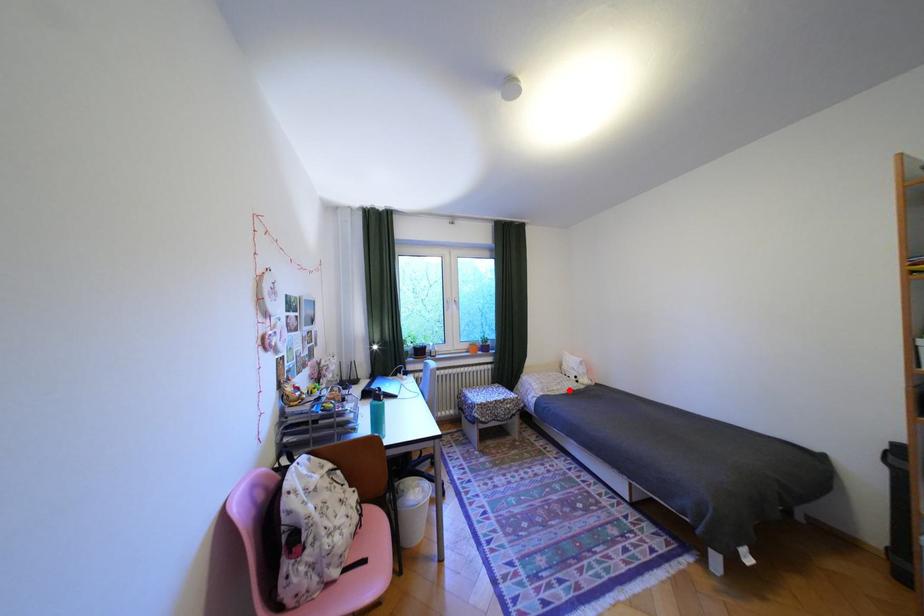
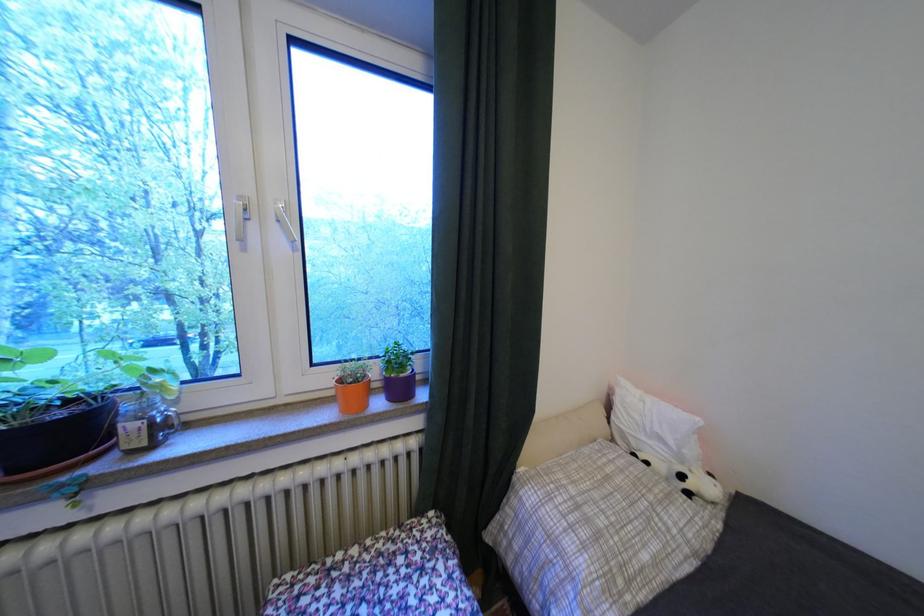
Question: I am providing you with two images of the same scene from different viewpoints. Image1 has a red point marked. In image2, the corresponding 3D location appears at what relative position? Reply with the corresponding letter.

Choices:
 (A) Closer
 (B) Farther

Answer: (A)